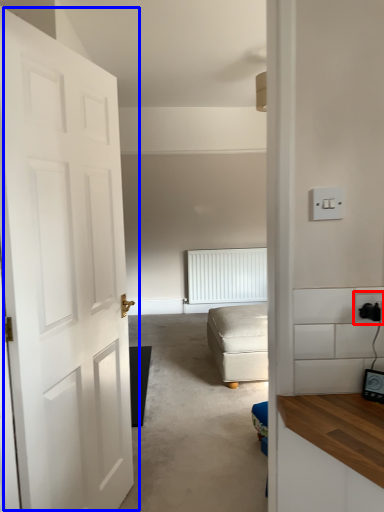
Question: Which object is further to the camera taking this photo, electric outlet (highlighted by a red box) or door (highlighted by a blue box)?

Choices:
 (A) electric outlet
 (B) door

Answer: (A)